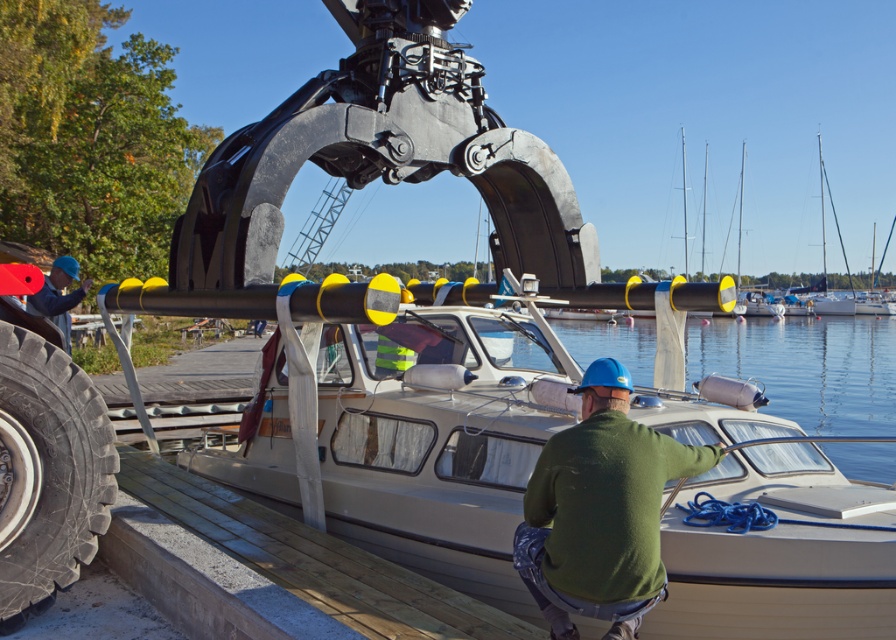
You are a crane operator trying to lower the white plastic boat at center into the clear water at boat right. What is the minimum distance you need to lower the boat to ensure it reaches the water?

The white plastic boat at center is 27.52 meters from the clear water at boat right, so you need to lower it at least 27.52 meters to ensure it reaches the water.

You are a dock worker trying to secure the boat with ropes. You have two items nearby, the black rubber tire at lower left and the clear water at boat right. Which item is narrower in width so you can place it between the ropes without interfering?

The black rubber tire at lower left is thinner than the clear water at boat right, so the black rubber tire at lower left can be placed between the ropes without interfering.

You are a dock worker who needs to know if the white plastic boat at center can fit through a narrow passage that is only as wide as the black rubber tire at lower left. Can it pass through?

The white plastic boat at center is wider than the black rubber tire at lower left, so it cannot pass through the narrow passage that is as wide as the black rubber tire at lower left.